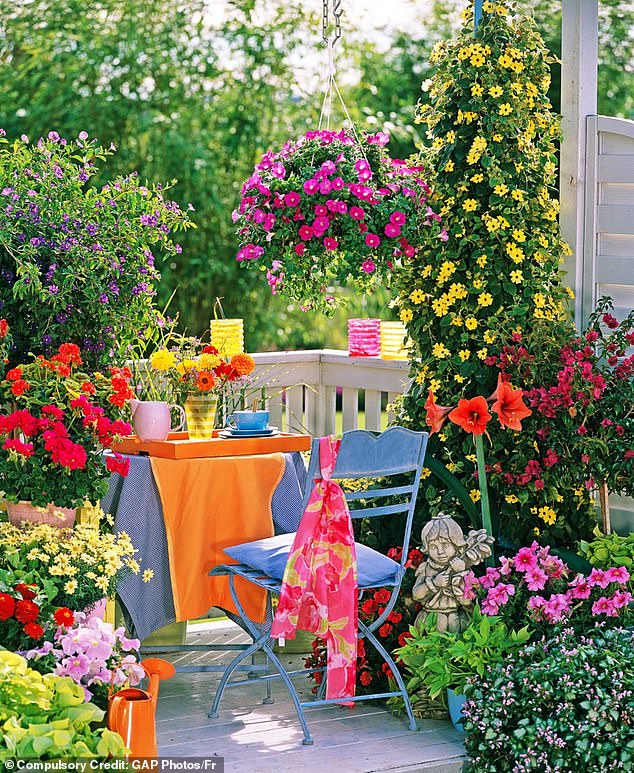
At what (x,y) coordinates should I click in order to perform the action: click on pitcher. Please return your answer as a coordinate pair (x, y). Image resolution: width=634 pixels, height=773 pixels. Looking at the image, I should click on (151, 424).